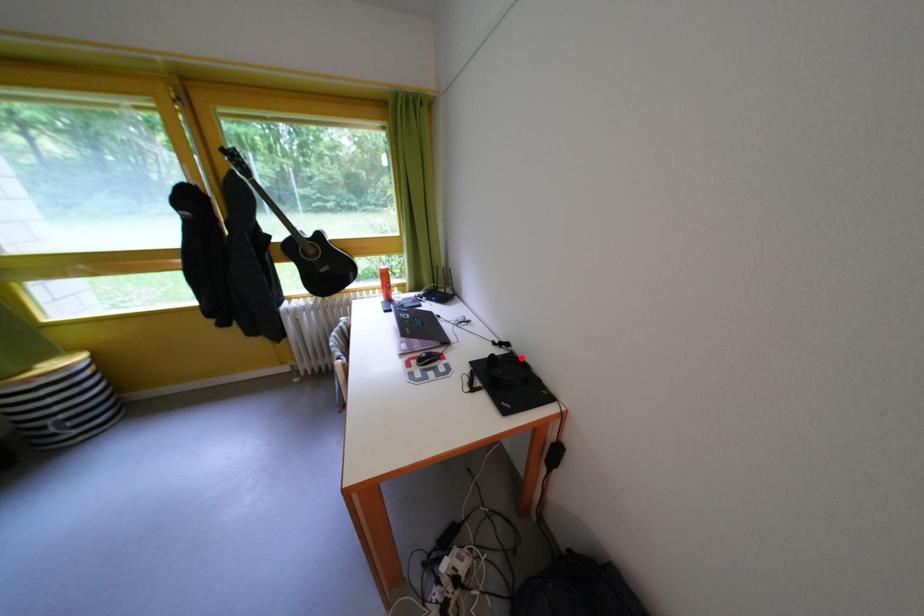
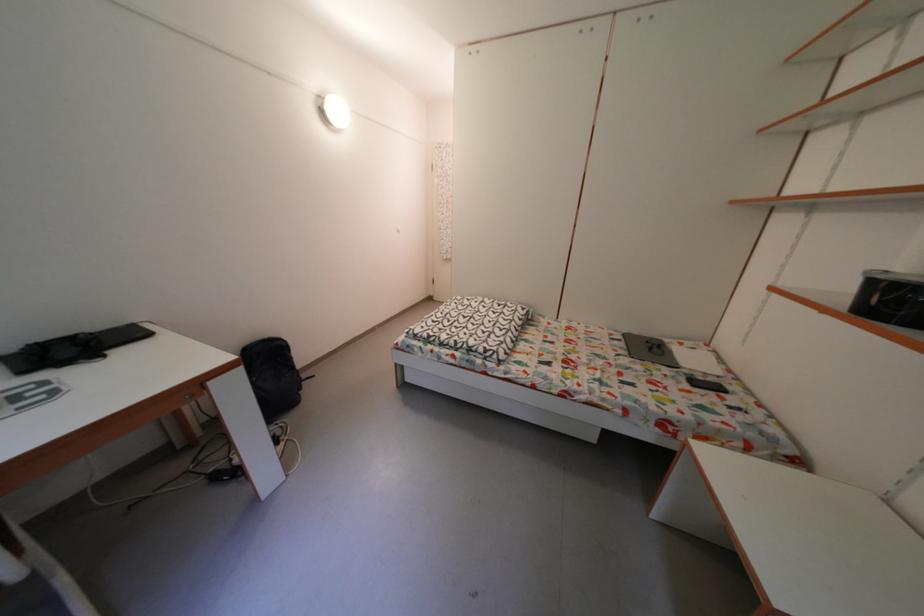
The point at the highlighted location is marked in the first image. Where is the corresponding point in the second image?

(6, 363)